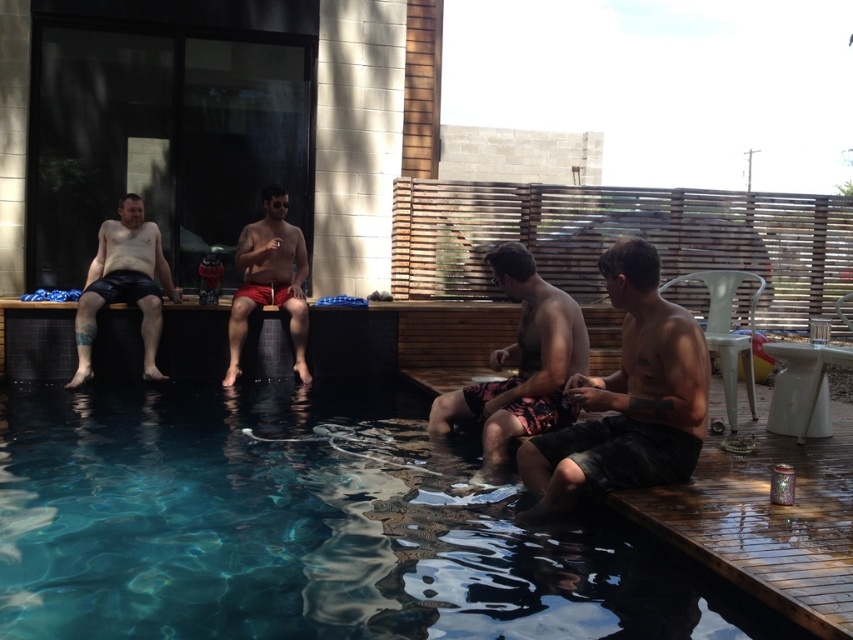
You are designing a poolside layout and need to place a small table between the clear blue water at lower left and the camouflage shorts at center. Which object should the table be closer to to ensure it fits within the available space?

The table should be placed closer to the camouflage shorts at center because the clear blue water at lower left has a larger width, allowing more space on that side for the table.

You are a photographer positioned at the edge of the pool. You want to take a photo that includes both the leather shorts at left and the matte red shorts at center. Which of the two items should you focus on first to ensure both are in sharp focus?

The leather shorts at left is closer to the viewer than matte red shorts at center. To ensure both are in sharp focus, you should focus on the leather shorts at left first, as it is closer, and use a smaller aperture to maximize depth of field.